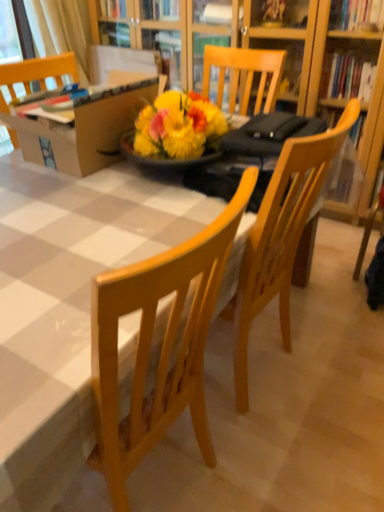
I want to click on free spot in front of cardboard box at upper left, so click(x=72, y=211).